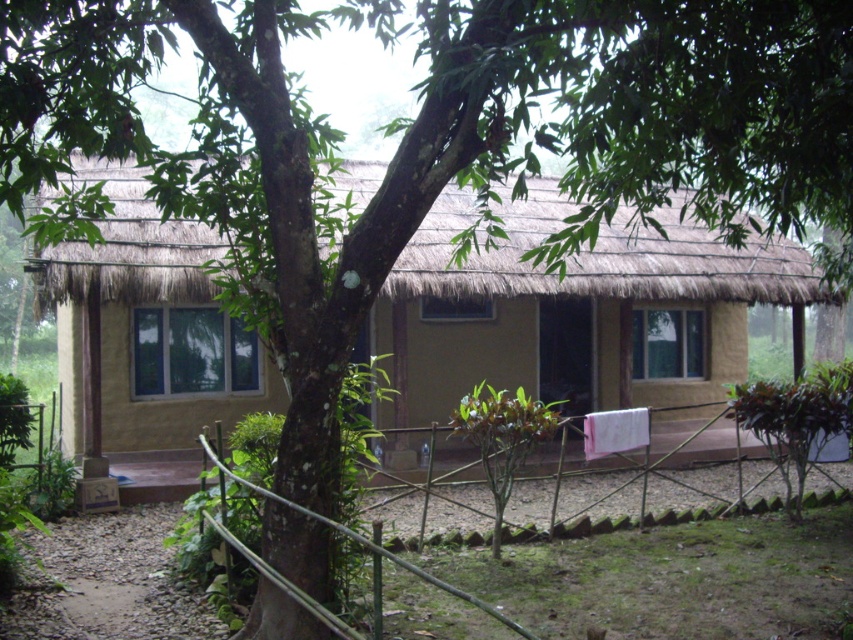
From the picture: You are a delivery person carrying a package that requires a 4 meter wide path to deliver. You see the beige clay hut at center and the bamboo fence at lower center. Is the space between them wide enough for your delivery path?

The beige clay hut at center and bamboo fence at lower center are 3.94 meters apart, which is slightly less than the required 4 meters. Therefore, the space between them is not wide enough for the delivery path.

You are standing in front of the rustic house and want to determine the position of two points marked on the image. Based on the scene description, which point is closer to you, point at coordinates point [404,380] or point at coordinates point [380,612]?

Point [404,380] is further to the camera than point [380,612], so the point closer to you is point [380,612].